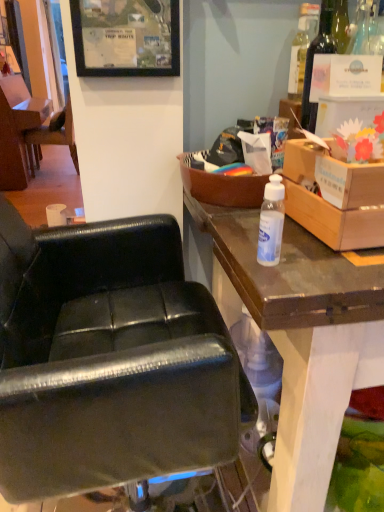
Question: Can you confirm if black matte picture frame at upper center is wider than black leather chair at center, which is the first chair from bottom to top?

Choices:
 (A) yes
 (B) no

Answer: (B)

Question: Is black matte picture frame at upper center not near black leather chair at center, the 2th chair from the back?

Choices:
 (A) yes
 (B) no

Answer: (B)

Question: Is black matte picture frame at upper center looking in the opposite direction of black leather chair at center, arranged as the second chair when viewed from the left?

Choices:
 (A) no
 (B) yes

Answer: (A)

Question: Does black matte picture frame at upper center appear on the right side of black leather chair at center, positioned as the 1th chair in front-to-back order?

Choices:
 (A) no
 (B) yes

Answer: (B)

Question: Is black matte picture frame at upper center thinner than black leather chair at center, placed as the first chair when sorted from right to left?

Choices:
 (A) no
 (B) yes

Answer: (B)

Question: Is black matte picture frame at upper center taller than black leather chair at center, the 2th chair from the back?

Choices:
 (A) yes
 (B) no

Answer: (B)

Question: Is cardboard box at upper right, the first box positioned from the right, further to camera compared to black leather chair at center, placed as the first chair when sorted from right to left?

Choices:
 (A) yes
 (B) no

Answer: (A)

Question: Is cardboard box at upper right, the first box positioned from the right, not within black leather chair at center, positioned as the 1th chair in front-to-back order?

Choices:
 (A) yes
 (B) no

Answer: (A)

Question: Can you confirm if cardboard box at upper right, the first box positioned from the right, is smaller than black leather chair at center, which is the first chair from bottom to top?

Choices:
 (A) yes
 (B) no

Answer: (A)

Question: Is the position of cardboard box at upper right, the second box from the left, less distant than that of black leather chair at center, which is the first chair from bottom to top?

Choices:
 (A) no
 (B) yes

Answer: (A)

Question: Is black leather chair at center, the 2th chair from the back, located within cardboard box at upper right, the second box from the left?

Choices:
 (A) yes
 (B) no

Answer: (B)

Question: From the image's perspective, is cardboard box at upper right, the first box positioned from the right, above black leather chair at center, placed as the first chair when sorted from right to left?

Choices:
 (A) no
 (B) yes

Answer: (B)

Question: Is black matte picture frame at upper center to the right of transparent plastic bottle at center, the 2th bottle positioned from the top, from the viewer's perspective?

Choices:
 (A) yes
 (B) no

Answer: (B)